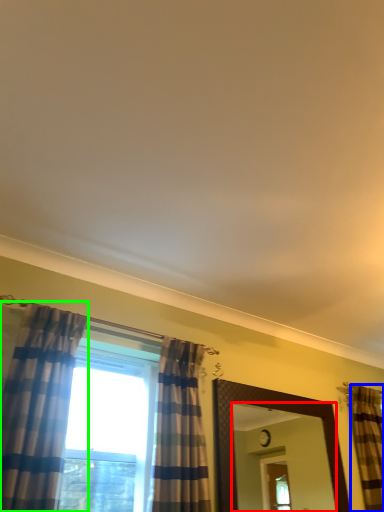
Question: Estimate the real-world distances between objects in this image. Which object is closer to mirror (highlighted by a red box), curtain (highlighted by a blue box) or curtain (highlighted by a green box)?

Choices:
 (A) curtain
 (B) curtain

Answer: (A)